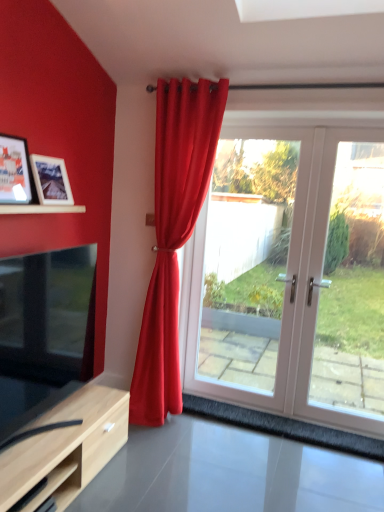
What is the approximate width of matte black tv at lower left?

It is 8.33 inches.

The image size is (384, 512). What do you see at coordinates (49, 316) in the screenshot?
I see `matte black tv at lower left` at bounding box center [49, 316].

This screenshot has width=384, height=512. I want to click on wooden shelf at lower left, so click(x=53, y=481).

What are the coordinates of `matte wooden picture frame at upper left, the 2th picture frame in the front-to-back sequence` in the screenshot? It's located at (51, 180).

In order to face white glossy glass door at right, should I rotate leftwards or rightwards?

To face it directly, rotate right by 21.266 degrees.

The image size is (384, 512). What do you see at coordinates (173, 234) in the screenshot? I see `matte red curtain at center` at bounding box center [173, 234].

Locate an element on the screen. The height and width of the screenshot is (512, 384). matte black tv at lower left is located at coordinates point(49,316).

Is matte red curtain at center surrounding matte black tv at lower left?

Actually, matte black tv at lower left is outside matte red curtain at center.

Is matte red curtain at center facing towards matte black tv at lower left?

No, matte red curtain at center is not oriented towards matte black tv at lower left.

Is matte red curtain at center far from matte black tv at lower left?

matte red curtain at center is actually quite close to matte black tv at lower left.

In the image, is matte red curtain at center positioned in front of or behind matte black tv at lower left?

→ Clearly, matte red curtain at center is behind matte black tv at lower left.

Consider the image. In terms of size, does matte red curtain at center appear bigger or smaller than wooden shelf at lower left?

matte red curtain at center is bigger than wooden shelf at lower left.

Is matte red curtain at center aimed at wooden shelf at lower left?

Yes.

Are matte red curtain at center and wooden shelf at lower left far apart?

Yes, matte red curtain at center and wooden shelf at lower left are quite far apart.

Based on the photo, can you confirm if matte wooden picture frame at upper left, the 1th picture frame when ordered from back to front, is shorter than matte red curtain at center?

Indeed, matte wooden picture frame at upper left, the 1th picture frame when ordered from back to front, has a lesser height compared to matte red curtain at center.

Is matte wooden picture frame at upper left, the 1th picture frame when ordered from back to front, facing towards matte red curtain at center?

No, matte wooden picture frame at upper left, the 1th picture frame when ordered from back to front, does not turn towards matte red curtain at center.

Image resolution: width=384 pixels, height=512 pixels. Find the location of `curtain located behind the matte wooden picture frame at upper left, the 2th picture frame in the front-to-back sequence`. curtain located behind the matte wooden picture frame at upper left, the 2th picture frame in the front-to-back sequence is located at coordinates (173, 234).

Is wooden picture frame at left, which appears as the second picture frame when viewed from the back, taller or shorter than matte wooden picture frame at upper left, the 2th picture frame in the front-to-back sequence?

Considering their sizes, wooden picture frame at left, which appears as the second picture frame when viewed from the back, has more height than matte wooden picture frame at upper left, the 2th picture frame in the front-to-back sequence.

Is wooden picture frame at left, which ranks as the first picture frame in front-to-back order, inside the boundaries of matte wooden picture frame at upper left, the 1th picture frame when ordered from back to front, or outside?

wooden picture frame at left, which ranks as the first picture frame in front-to-back order, is not enclosed by matte wooden picture frame at upper left, the 1th picture frame when ordered from back to front.

Can you confirm if white glossy glass door at right is thinner than matte wooden picture frame at upper left, the 2th picture frame in the front-to-back sequence?

Yes, white glossy glass door at right is thinner than matte wooden picture frame at upper left, the 2th picture frame in the front-to-back sequence.

Does white glossy glass door at right touch matte wooden picture frame at upper left, the 1th picture frame when ordered from back to front?

No, white glossy glass door at right is not making contact with matte wooden picture frame at upper left, the 1th picture frame when ordered from back to front.

From the image's perspective, is white glossy glass door at right located above or below matte wooden picture frame at upper left, the 2th picture frame in the front-to-back sequence?

From the image's perspective, white glossy glass door at right appears below matte wooden picture frame at upper left, the 2th picture frame in the front-to-back sequence.

From the image's perspective, is matte red curtain at center on white glossy glass door at right?

Yes.

Is matte red curtain at center aimed at white glossy glass door at right?

No, matte red curtain at center is not aimed at white glossy glass door at right.

Would you consider matte red curtain at center to be distant from white glossy glass door at right?

matte red curtain at center is near white glossy glass door at right, not far away.

Measure the distance from matte red curtain at center to white glossy glass door at right.

matte red curtain at center and white glossy glass door at right are 37.20 inches apart.

Relative to white glossy glass door at right, is wooden picture frame at left, which ranks as the first picture frame in front-to-back order, in front or behind?

Clearly, wooden picture frame at left, which ranks as the first picture frame in front-to-back order, is in front of white glossy glass door at right.

Who is bigger, wooden picture frame at left, which ranks as the first picture frame in front-to-back order, or white glossy glass door at right?

white glossy glass door at right is bigger.

From their relative heights in the image, would you say wooden picture frame at left, which ranks as the first picture frame in front-to-back order, is taller or shorter than white glossy glass door at right?

Considering their sizes, wooden picture frame at left, which ranks as the first picture frame in front-to-back order, has less height than white glossy glass door at right.

At what (x,y) coordinates should I click in order to perform the action: click on curtain lying on the right of matte black tv at lower left. Please return your answer as a coordinate pair (x, y). This screenshot has width=384, height=512. Looking at the image, I should click on (173, 234).

Identify the location of curtain located above the wooden shelf at lower left (from the image's perspective). (173, 234).

From the image, which object appears to be farther from white glossy glass door at right, matte red curtain at center or wooden shelf at lower left?

wooden shelf at lower left is further to white glossy glass door at right.

Looking at the image, which one is located closer to matte red curtain at center, wooden shelf at lower left or matte black tv at lower left?

matte black tv at lower left is positioned closer to the anchor matte red curtain at center.

Which object lies further to the anchor point wooden picture frame at left, which ranks as the first picture frame in front-to-back order, matte wooden picture frame at upper left, the 2th picture frame in the front-to-back sequence, or white glossy glass door at right?

white glossy glass door at right is positioned further to the anchor wooden picture frame at left, which ranks as the first picture frame in front-to-back order.

Looking at the image, which one is located closer to matte wooden picture frame at upper left, the 2th picture frame in the front-to-back sequence, matte black tv at lower left or matte red curtain at center?

matte black tv at lower left.

Based on the photo, which object lies further to the anchor point white glossy glass door at right, wooden picture frame at left, which appears as the second picture frame when viewed from the back, or wooden shelf at lower left?

wooden shelf at lower left is positioned further to the anchor white glossy glass door at right.

Based on their spatial positions, is white glossy door at center or matte wooden picture frame at upper left, the 2th picture frame in the front-to-back sequence, closer to wooden shelf at lower left?

Based on the image, matte wooden picture frame at upper left, the 2th picture frame in the front-to-back sequence, appears to be nearer to wooden shelf at lower left.

Based on their spatial positions, is matte red curtain at center or white glossy glass door at right further from matte black tv at lower left?

The object further to matte black tv at lower left is white glossy glass door at right.

Which object lies nearer to the anchor point matte wooden picture frame at upper left, the 1th picture frame when ordered from back to front, white glossy glass door at right or matte black tv at lower left?

matte black tv at lower left lies closer to matte wooden picture frame at upper left, the 1th picture frame when ordered from back to front, than the other object.

Locate an element on the screen. The width and height of the screenshot is (384, 512). picture frame between wooden picture frame at left, which ranks as the first picture frame in front-to-back order, and matte black tv at lower left vertically is located at coordinates (51, 180).

Where is `curtain situated between matte black tv at lower left and white glossy glass door at right from left to right`? The width and height of the screenshot is (384, 512). curtain situated between matte black tv at lower left and white glossy glass door at right from left to right is located at coordinates (173, 234).

This screenshot has height=512, width=384. I want to click on curtain located between wooden picture frame at left, which ranks as the first picture frame in front-to-back order, and white glossy door at center in the left-right direction, so click(x=173, y=234).

What are the coordinates of `television between wooden shelf at lower left and white glossy glass door at right from left to right` in the screenshot? It's located at click(x=49, y=316).